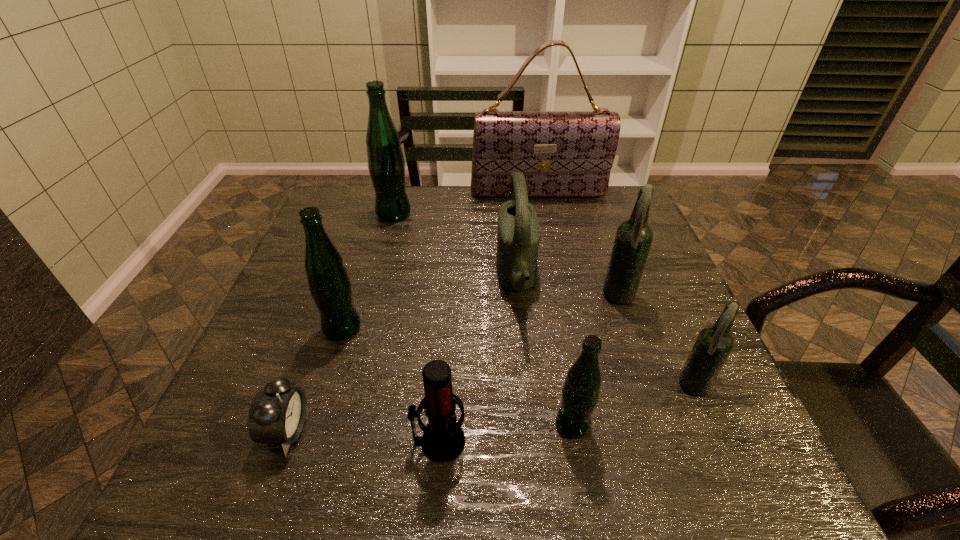
Locate an element on the screen. empty space between the red microphone and the rightmost green beer bottle is located at coordinates (506, 433).

At what (x,y) coordinates should I click in order to perform the action: click on vacant point located between the farther dark beer bottle and the fourth nearest object. Please return your answer as a coordinate pair (x, y). This screenshot has width=960, height=540. Looking at the image, I should click on (657, 343).

This screenshot has width=960, height=540. I want to click on vacant space in between the fourth beer bottle from left to right and the green watering can, so click(568, 288).

Find the location of a particular element. empty space between the watering can and the farthest beer bottle is located at coordinates (455, 246).

Identify the location of free point between the nearest beer bottle and the microphone. point(506,433).

The width and height of the screenshot is (960, 540). Find the location of `blank region between the fourth beer bottle from left to right and the watering can`. blank region between the fourth beer bottle from left to right and the watering can is located at coordinates pyautogui.click(x=568, y=288).

At what (x,y) coordinates should I click in order to perform the action: click on unoccupied area between the farthest object and the second farthest object. Please return your answer as a coordinate pair (x, y). Looking at the image, I should click on (467, 204).

Find the location of a particular element. This screenshot has width=960, height=540. free space between the green watering can and the second smallest green beer bottle is located at coordinates (429, 303).

I want to click on vacant region between the nearest green beer bottle and the watering can, so click(x=544, y=351).

The image size is (960, 540). In order to click on object that is the eighth closest to the second farthest object in this screenshot , I will do (714, 343).